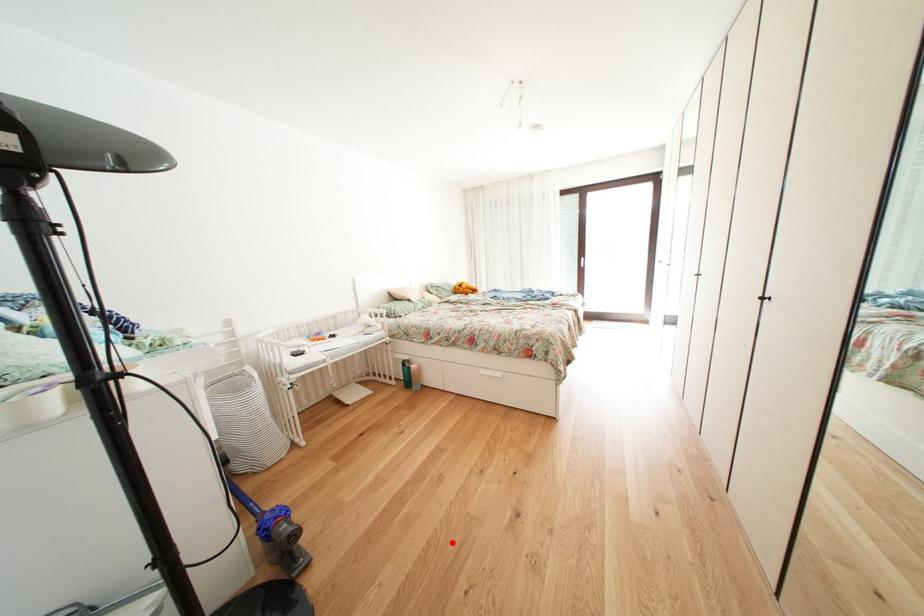
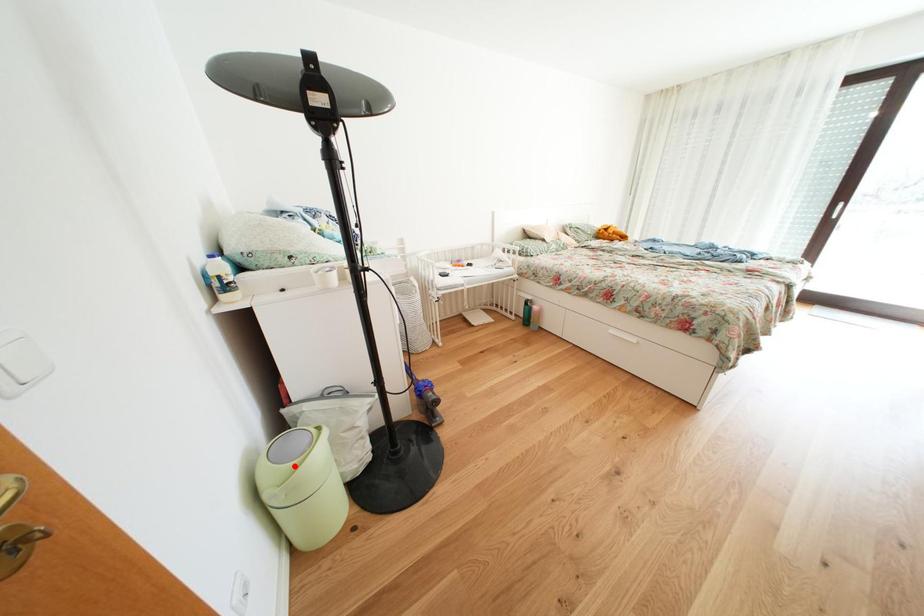
I am providing you with two images of the same scene from different viewpoints. A red point is marked on the first image and another point is marked on the second image. Are the points marked in image1 and image2 representing the same 3D position?

No